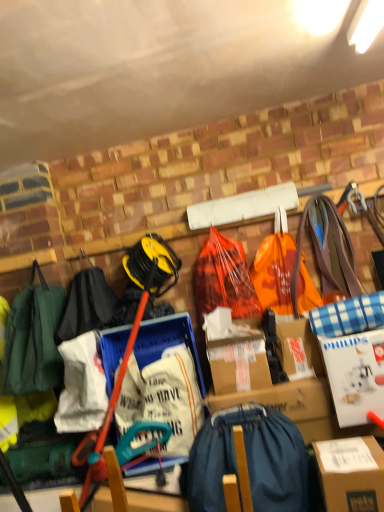
Where is `orange plastic bag at center, the 2th grocery bag when ordered from right to left`? orange plastic bag at center, the 2th grocery bag when ordered from right to left is located at coordinates (224, 279).

Looking at this image, measure the distance between orange plastic grocery bag at center, the 1th grocery bag in the right-to-left sequence, and camera.

orange plastic grocery bag at center, the 1th grocery bag in the right-to-left sequence, and camera are 1.95 meters apart from each other.

Locate an element on the screen. This screenshot has width=384, height=512. orange plastic bag at center, marked as the 1th grocery bag in a left-to-right arrangement is located at coordinates (224, 279).

Is denim backpack at center facing towards brown cardboard box at lower right?

No, denim backpack at center does not turn towards brown cardboard box at lower right.

Which is farther, (x=299, y=484) or (x=364, y=503)?

Positioned behind is point (x=299, y=484).

Are denim backpack at center and brown cardboard box at lower right beside each other?

denim backpack at center and brown cardboard box at lower right are clearly separated.

Is denim backpack at center at the right side of brown cardboard box at lower right?

Incorrect, denim backpack at center is not on the right side of brown cardboard box at lower right.

Between orange plastic grocery bag at center, the 1th grocery bag in the right-to-left sequence, and orange plastic bag at center, the 2th grocery bag when ordered from right to left, which one has smaller width?

orange plastic bag at center, the 2th grocery bag when ordered from right to left.

How different are the orientations of orange plastic grocery bag at center, the 1th grocery bag in the right-to-left sequence, and orange plastic bag at center, the 2th grocery bag when ordered from right to left, in degrees?

The angle between the facing direction of orange plastic grocery bag at center, the 1th grocery bag in the right-to-left sequence, and the facing direction of orange plastic bag at center, the 2th grocery bag when ordered from right to left, is 3.11 degrees.

In the scene shown: Could you tell me if orange plastic grocery bag at center, the 1th grocery bag in the right-to-left sequence, is facing orange plastic bag at center, marked as the 1th grocery bag in a left-to-right arrangement?

No, orange plastic grocery bag at center, the 1th grocery bag in the right-to-left sequence, is not oriented towards orange plastic bag at center, marked as the 1th grocery bag in a left-to-right arrangement.

Which object is positioned more to the right, orange plastic grocery bag at center, the 1th grocery bag in the right-to-left sequence, or orange plastic bag at center, marked as the 1th grocery bag in a left-to-right arrangement?

From the viewer's perspective, orange plastic grocery bag at center, the 1th grocery bag in the right-to-left sequence, appears more on the right side.

In the image, there is a orange plastic grocery bag at center, the 1th grocery bag in the right-to-left sequence. Where is `cardboard box below it (from a real-world perspective)`? cardboard box below it (from a real-world perspective) is located at coordinates (355, 375).

Considering the positions of points (288, 253) and (337, 412), is point (288, 253) farther from camera compared to point (337, 412)?

Yes, it is behind point (337, 412).

Are orange plastic grocery bag at center, placed as the second grocery bag when sorted from left to right, and white cardboard box at right beside each other?

No, orange plastic grocery bag at center, placed as the second grocery bag when sorted from left to right, is not in contact with white cardboard box at right.

From the picture: How much distance is there between orange plastic grocery bag at center, the 1th grocery bag in the right-to-left sequence, and white cardboard box at right?

The distance of orange plastic grocery bag at center, the 1th grocery bag in the right-to-left sequence, from white cardboard box at right is 18.56 inches.

Based on their sizes in the image, would you say white cardboard box at right is bigger or smaller than orange plastic bag at center, the 2th grocery bag when ordered from right to left?

white cardboard box at right is smaller than orange plastic bag at center, the 2th grocery bag when ordered from right to left.

From a real-world perspective, which is physically below, white cardboard box at right or orange plastic bag at center, marked as the 1th grocery bag in a left-to-right arrangement?

From a 3D spatial view, white cardboard box at right is below.

Which of these two, white cardboard box at right or orange plastic bag at center, the 2th grocery bag when ordered from right to left, is thinner?

With smaller width is orange plastic bag at center, the 2th grocery bag when ordered from right to left.

Considering the sizes of objects white cardboard box at right and orange plastic bag at center, the 2th grocery bag when ordered from right to left, in the image provided, who is shorter, white cardboard box at right or orange plastic bag at center, the 2th grocery bag when ordered from right to left,?

Standing shorter between the two is white cardboard box at right.

Consider the image. Could brown cardboard box at lower right be considered to be inside orange plastic grocery bag at center, placed as the second grocery bag when sorted from left to right?

No, brown cardboard box at lower right is not a part of orange plastic grocery bag at center, placed as the second grocery bag when sorted from left to right.

Which is behind, point (301, 288) or point (345, 444)?

Point (301, 288)

Can you confirm if orange plastic grocery bag at center, the 1th grocery bag in the right-to-left sequence, is bigger than brown cardboard box at lower right?

Yes.

Can you confirm if orange plastic grocery bag at center, placed as the second grocery bag when sorted from left to right, is taller than brown cardboard box at lower right?

Correct, orange plastic grocery bag at center, placed as the second grocery bag when sorted from left to right, is much taller as brown cardboard box at lower right.

Would you say orange plastic bag at center, marked as the 1th grocery bag in a left-to-right arrangement, contains orange plastic grocery bag at center, placed as the second grocery bag when sorted from left to right?

No, orange plastic grocery bag at center, placed as the second grocery bag when sorted from left to right, is not surrounded by orange plastic bag at center, marked as the 1th grocery bag in a left-to-right arrangement.

Considering the positions of objects orange plastic bag at center, the 2th grocery bag when ordered from right to left, and orange plastic grocery bag at center, the 1th grocery bag in the right-to-left sequence, in the image provided, who is more to the left, orange plastic bag at center, the 2th grocery bag when ordered from right to left, or orange plastic grocery bag at center, the 1th grocery bag in the right-to-left sequence,?

→ Positioned to the left is orange plastic bag at center, the 2th grocery bag when ordered from right to left.

In terms of width, does orange plastic bag at center, marked as the 1th grocery bag in a left-to-right arrangement, look wider or thinner when compared to orange plastic grocery bag at center, the 1th grocery bag in the right-to-left sequence?

In the image, orange plastic bag at center, marked as the 1th grocery bag in a left-to-right arrangement, appears to be more narrow than orange plastic grocery bag at center, the 1th grocery bag in the right-to-left sequence.

Does orange plastic bag at center, the 2th grocery bag when ordered from right to left, turn towards orange plastic grocery bag at center, the 1th grocery bag in the right-to-left sequence?

No, orange plastic bag at center, the 2th grocery bag when ordered from right to left, does not turn towards orange plastic grocery bag at center, the 1th grocery bag in the right-to-left sequence.

Is white cardboard box at right oriented away from orange plastic grocery bag at center, placed as the second grocery bag when sorted from left to right?

No, orange plastic grocery bag at center, placed as the second grocery bag when sorted from left to right, is not at the back of white cardboard box at right.

From a real-world perspective, is white cardboard box at right located beneath orange plastic grocery bag at center, placed as the second grocery bag when sorted from left to right?

Yes, from a real-world perspective, white cardboard box at right is beneath orange plastic grocery bag at center, placed as the second grocery bag when sorted from left to right.

Between white cardboard box at right and orange plastic grocery bag at center, the 1th grocery bag in the right-to-left sequence, which one has less height?

white cardboard box at right is shorter.

At what (x,y) coordinates should I click in order to perform the action: click on box on the right of denim backpack at center. Please return your answer as a coordinate pair (x, y). This screenshot has height=512, width=384. Looking at the image, I should click on (351, 474).

At what (x,y) coordinates should I click in order to perform the action: click on grocery bag behind the orange plastic grocery bag at center, the 1th grocery bag in the right-to-left sequence. Please return your answer as a coordinate pair (x, y). The height and width of the screenshot is (512, 384). Looking at the image, I should click on (224, 279).

From the image, which object appears to be nearer to orange plastic bag at center, marked as the 1th grocery bag in a left-to-right arrangement, orange plastic grocery bag at center, the 1th grocery bag in the right-to-left sequence, or denim backpack at center?

The object closer to orange plastic bag at center, marked as the 1th grocery bag in a left-to-right arrangement, is orange plastic grocery bag at center, the 1th grocery bag in the right-to-left sequence.

When comparing their distances from white cardboard box at right, does brown cardboard box at lower right or orange plastic grocery bag at center, the 1th grocery bag in the right-to-left sequence, seem closer?

brown cardboard box at lower right is positioned closer to the anchor white cardboard box at right.

When comparing their distances from orange plastic grocery bag at center, placed as the second grocery bag when sorted from left to right, does orange plastic bag at center, the 2th grocery bag when ordered from right to left, or white cardboard box at right seem further?

white cardboard box at right is positioned further to the anchor orange plastic grocery bag at center, placed as the second grocery bag when sorted from left to right.

Looking at the image, which one is located further to orange plastic grocery bag at center, the 1th grocery bag in the right-to-left sequence, brown cardboard box at lower right or white cardboard box at right?

Among the two, brown cardboard box at lower right is located further to orange plastic grocery bag at center, the 1th grocery bag in the right-to-left sequence.

Which object lies further to the anchor point orange plastic grocery bag at center, placed as the second grocery bag when sorted from left to right, orange plastic bag at center, marked as the 1th grocery bag in a left-to-right arrangement, or brown cardboard box at lower right?

brown cardboard box at lower right.

Which object lies nearer to the anchor point denim backpack at center, orange plastic grocery bag at center, the 1th grocery bag in the right-to-left sequence, or brown cardboard box at lower right?

brown cardboard box at lower right is positioned closer to the anchor denim backpack at center.

Looking at the image, which one is located further to orange plastic grocery bag at center, the 1th grocery bag in the right-to-left sequence, orange plastic bag at center, marked as the 1th grocery bag in a left-to-right arrangement, or denim backpack at center?

denim backpack at center lies further to orange plastic grocery bag at center, the 1th grocery bag in the right-to-left sequence, than the other object.

Consider the image. Estimate the real-world distances between objects in this image. Which object is closer to denim backpack at center, brown cardboard box at lower right or orange plastic grocery bag at center, placed as the second grocery bag when sorted from left to right?

brown cardboard box at lower right.

Where is `grocery bag between orange plastic grocery bag at center, the 1th grocery bag in the right-to-left sequence, and denim backpack at center from top to bottom`? grocery bag between orange plastic grocery bag at center, the 1th grocery bag in the right-to-left sequence, and denim backpack at center from top to bottom is located at coordinates (224, 279).

You are a GUI agent. You are given a task and a screenshot of the screen. Output one action in this format:
    pyautogui.click(x=<x>, y=<y>)
    Task: Click on the box between orange plastic bag at center, the 2th grocery bag when ordered from right to left, and denim backpack at center in the up-down direction
    Image resolution: width=384 pixels, height=512 pixels.
    Given the screenshot: What is the action you would take?
    pyautogui.click(x=351, y=474)

This screenshot has height=512, width=384. In order to click on grocery bag between orange plastic bag at center, marked as the 1th grocery bag in a left-to-right arrangement, and white cardboard box at right in this screenshot , I will do `click(282, 276)`.

Locate an element on the screen. cardboard box between orange plastic grocery bag at center, placed as the second grocery bag when sorted from left to right, and denim backpack at center vertically is located at coordinates (355, 375).